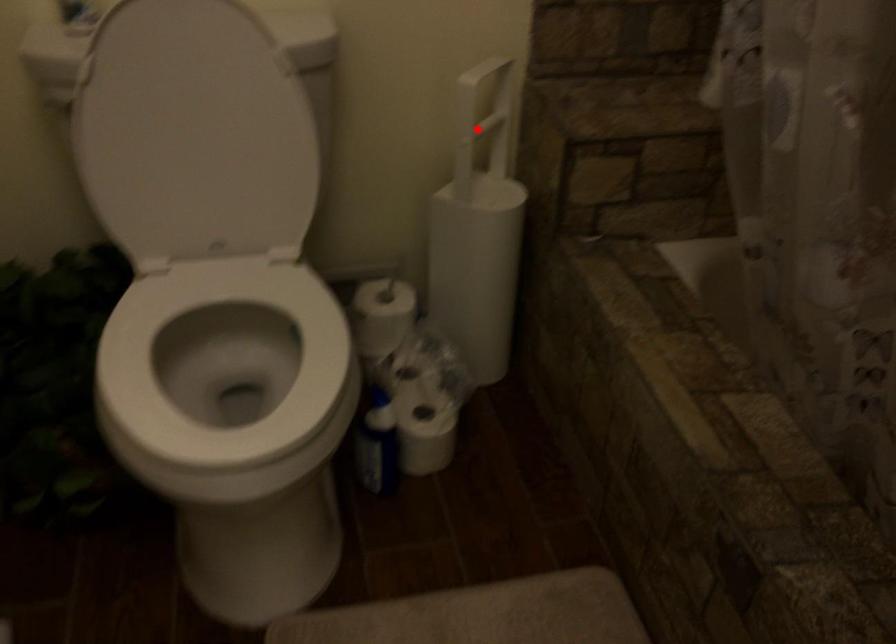
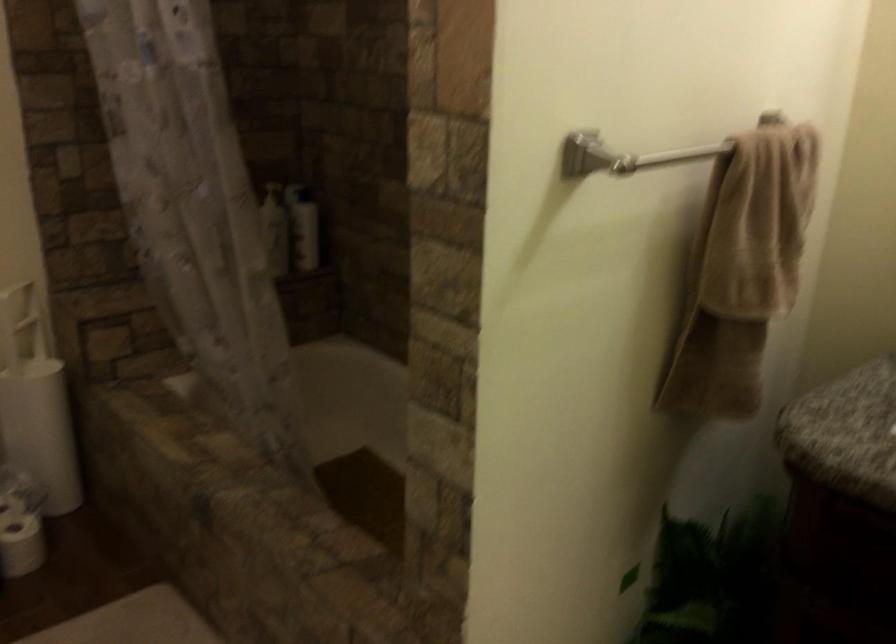
Question: I am providing you with two images of the same scene from different viewpoints. In image1, a red point is highlighted. Considering the same 3D point in image2, which of the following is correct?

Choices:
 (A) It is closer
 (B) It is farther

Answer: (B)